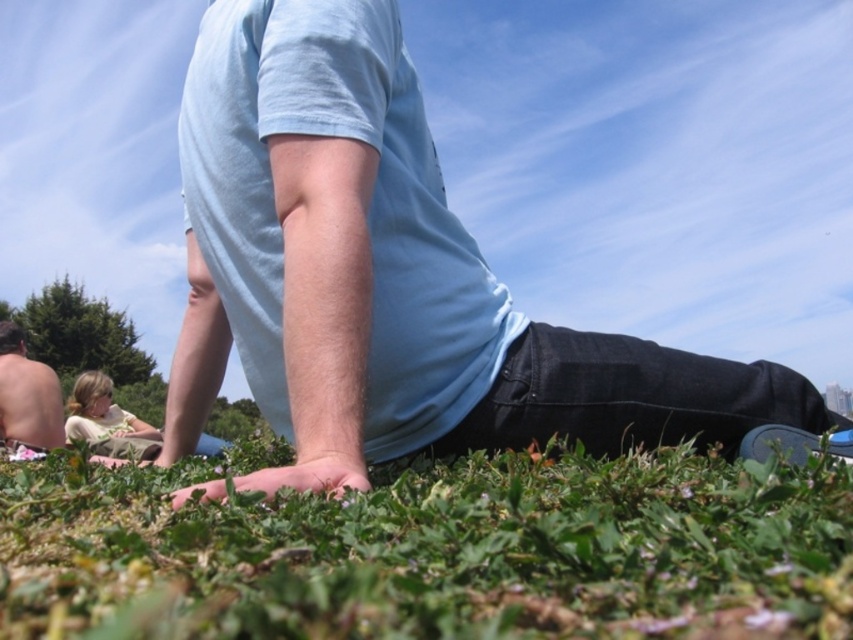
Can you confirm if light blue cotton shirt at center is positioned above shiny silver torso at lower left?

Yes, light blue cotton shirt at center is above shiny silver torso at lower left.

Is light blue cotton shirt at center smaller than shiny silver torso at lower left?

Actually, light blue cotton shirt at center might be larger than shiny silver torso at lower left.

What do you see at coordinates (389, 276) in the screenshot?
I see `light blue cotton shirt at center` at bounding box center [389, 276].

Where is `light blue cotton shirt at center`? Image resolution: width=853 pixels, height=640 pixels. light blue cotton shirt at center is located at coordinates pyautogui.click(x=389, y=276).

How distant is light blue cotton shirt at center from green grass at lower center?

light blue cotton shirt at center and green grass at lower center are 11.79 inches apart.

Does light blue cotton shirt at center have a larger size compared to green grass at lower center?

Indeed, light blue cotton shirt at center has a larger size compared to green grass at lower center.

Where is `light blue cotton shirt at center`? The image size is (853, 640). light blue cotton shirt at center is located at coordinates (x=389, y=276).

Who is positioned more to the right, green grass at lower center or shiny silver torso at lower left?

From the viewer's perspective, green grass at lower center appears more on the right side.

Is point (583, 570) farther from viewer compared to point (39, 419)?

No, (583, 570) is closer to viewer.

Is point (274, 522) closer to viewer compared to point (7, 432)?

Yes, it is in front of point (7, 432).

The image size is (853, 640). In order to click on green grass at lower center in this screenshot , I will do [434, 552].